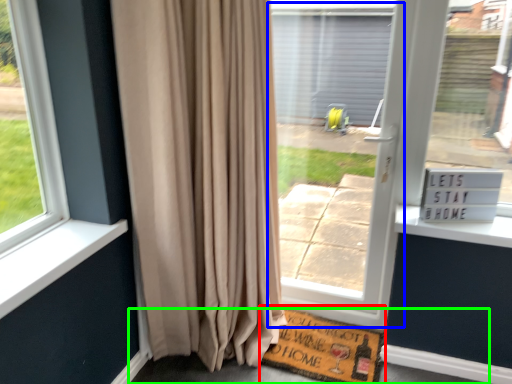
Question: Which object is positioned farthest from doormat (highlighted by a red box)? Select from screen door (highlighted by a blue box) and pavement (highlighted by a green box).

Choices:
 (A) screen door
 (B) pavement

Answer: (A)